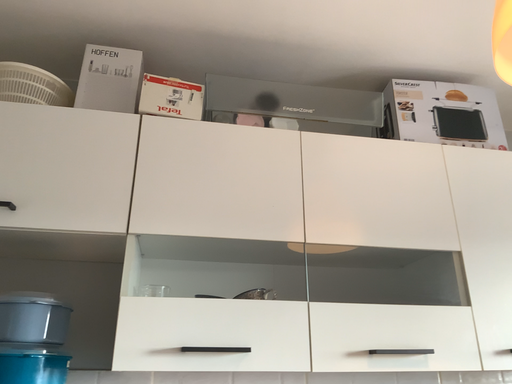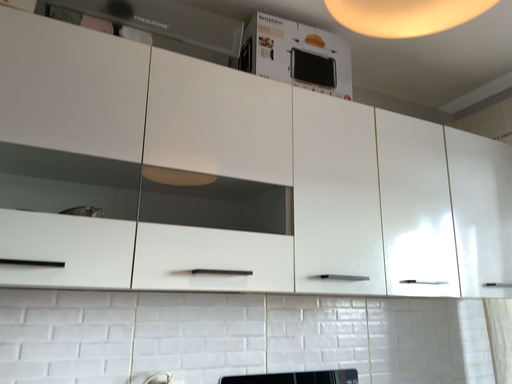
Question: Which way did the camera rotate in the video?

Choices:
 (A) rotated right
 (B) rotated left

Answer: (A)